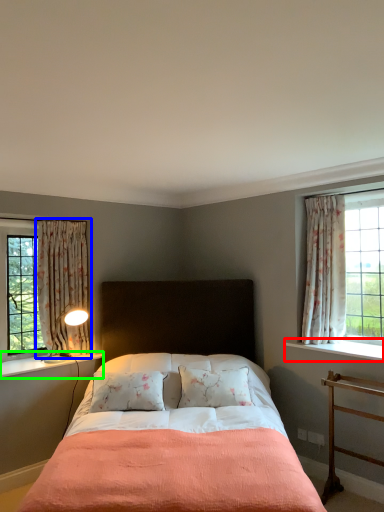
Question: Based on their relative distances, which object is farther from window sill (highlighted by a red box)? Choose from curtain (highlighted by a blue box) and window sill (highlighted by a green box).

Choices:
 (A) curtain
 (B) window sill

Answer: (A)